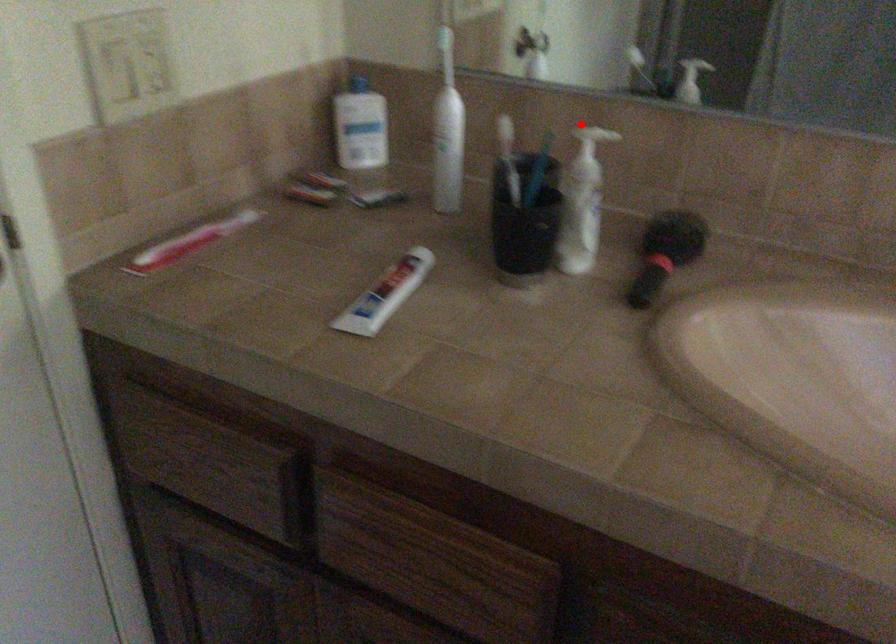
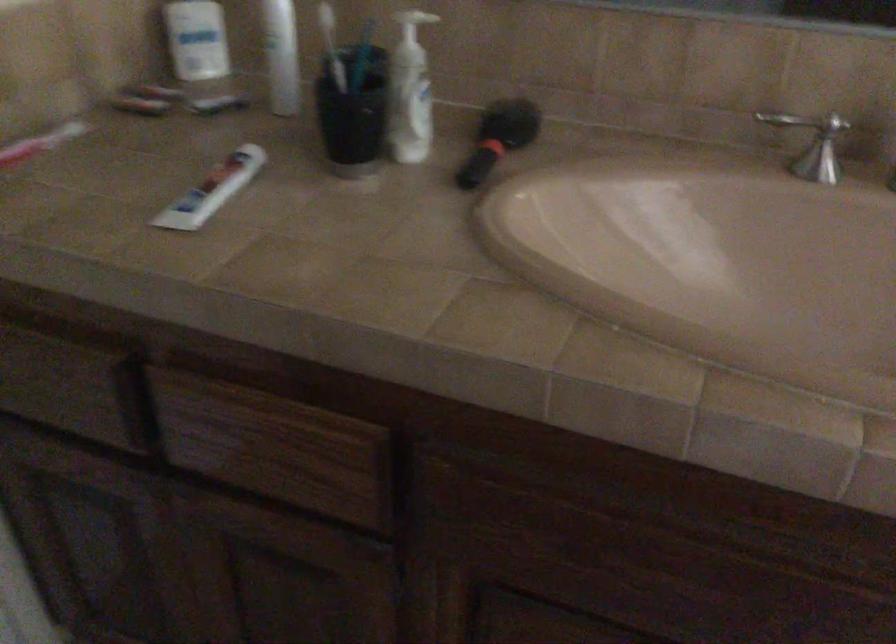
Locate, in the second image, the point that corresponds to the highlighted location in the first image.

(412, 23)